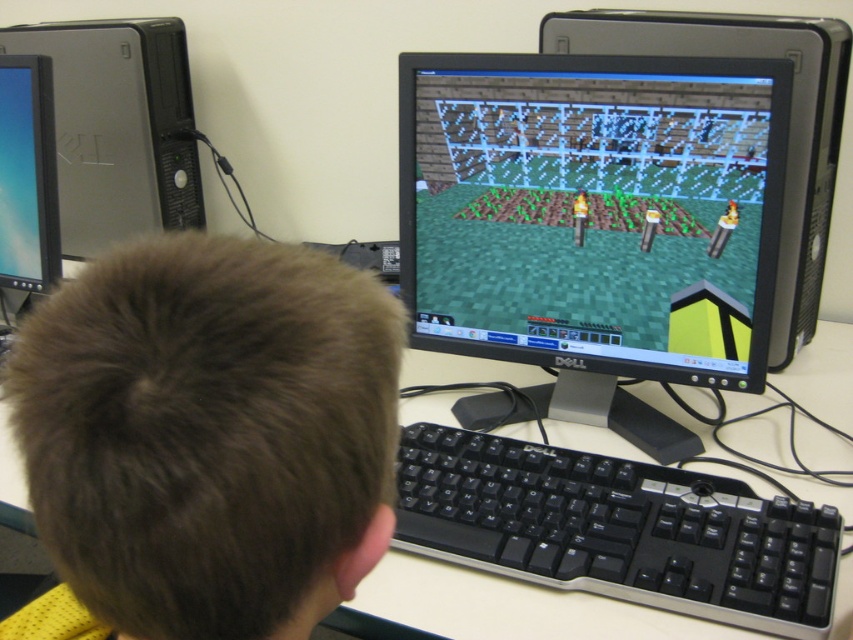
Question: Estimate the real-world distances between objects in this image. Which object is closer to the black plastic keyboard at center?

Choices:
 (A) brown hair at center
 (B) matte black monitor at center

Answer: (B)

Question: Estimate the real-world distances between objects in this image. Which object is farther from the matte black monitor at left?

Choices:
 (A) brown hair at center
 (B) white plastic computer desk at center
 (C) matte black monitor at center
 (D) black plastic keyboard at center

Answer: (B)

Question: Which point appears farthest from the camera in this image?

Choices:
 (A) pyautogui.click(x=234, y=627)
 (B) pyautogui.click(x=664, y=509)
 (C) pyautogui.click(x=155, y=211)

Answer: (C)

Question: Is the position of satin silver tower at upper left more distant than that of matte black monitor at left?

Choices:
 (A) no
 (B) yes

Answer: (B)

Question: Does black plastic keyboard at center appear on the right side of satin silver tower at upper left?

Choices:
 (A) no
 (B) yes

Answer: (B)

Question: Does white plastic computer desk at center appear over matte black monitor at center?

Choices:
 (A) yes
 (B) no

Answer: (B)